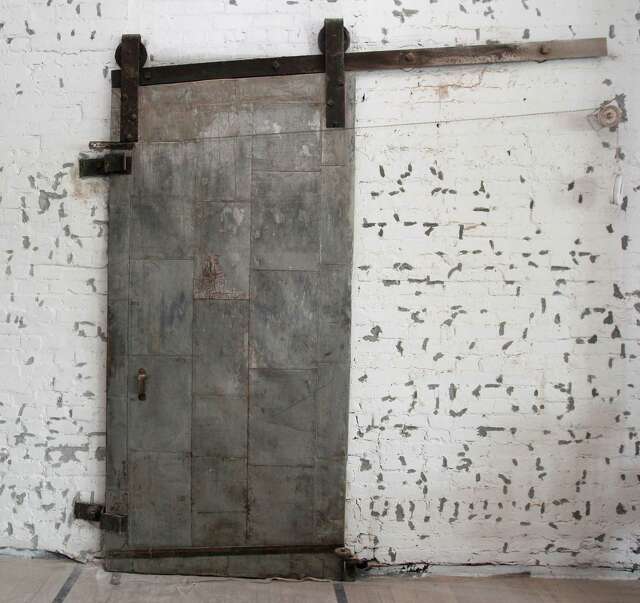
The width and height of the screenshot is (640, 603). What are the coordinates of `door mount` in the screenshot? It's located at (x=130, y=93), (x=333, y=89).